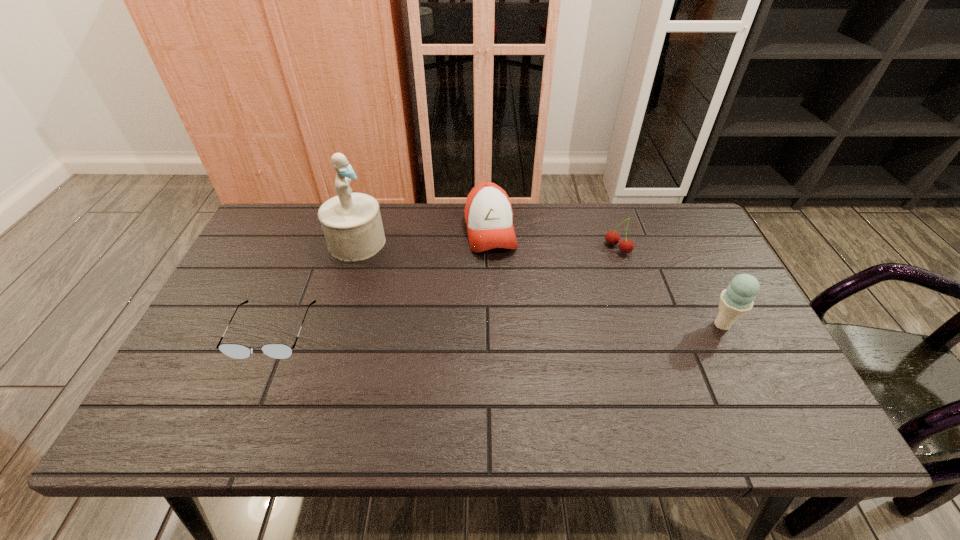
The width and height of the screenshot is (960, 540). What are the coordinates of `free spot between the tallest object and the third object from right to left` in the screenshot? It's located at (423, 237).

Identify the location of vacant space in between the spectacles and the cherry. The width and height of the screenshot is (960, 540). (445, 289).

What are the coordinates of `free space between the figurine and the third object from right to left` in the screenshot? It's located at (423, 237).

The width and height of the screenshot is (960, 540). Identify the location of unoccupied position between the shortest object and the third object from right to left. (381, 281).

In order to click on vacant area that lies between the tallest object and the baseball cap in this screenshot , I will do `click(423, 237)`.

Where is `vacant area that lies between the figurine and the third object from right to left`? The width and height of the screenshot is (960, 540). vacant area that lies between the figurine and the third object from right to left is located at coordinates (423, 237).

Where is `vacant space that is in between the cherry and the spectacles`? This screenshot has height=540, width=960. vacant space that is in between the cherry and the spectacles is located at coordinates (445, 289).

Select which object is the fourth closest to the third object from right to left. Please provide its 2D coordinates. Your answer should be formatted as a tuple, i.e. [(x, y)], where the tuple contains the x and y coordinates of a point satisfying the conditions above.

[(738, 299)]

Where is `object that stands as the second closest to the spectacles`? Image resolution: width=960 pixels, height=540 pixels. object that stands as the second closest to the spectacles is located at coordinates (488, 212).